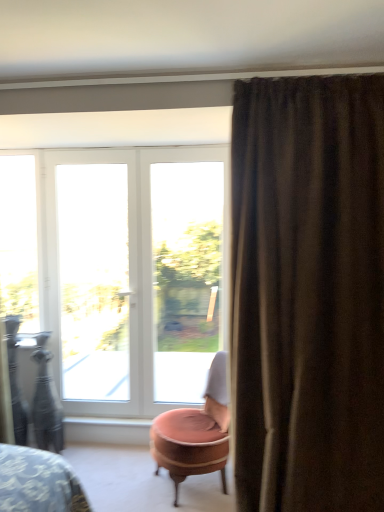
Where is `free point to the left of pink velvet ottoman at center`? Image resolution: width=384 pixels, height=512 pixels. free point to the left of pink velvet ottoman at center is located at coordinates (130, 477).